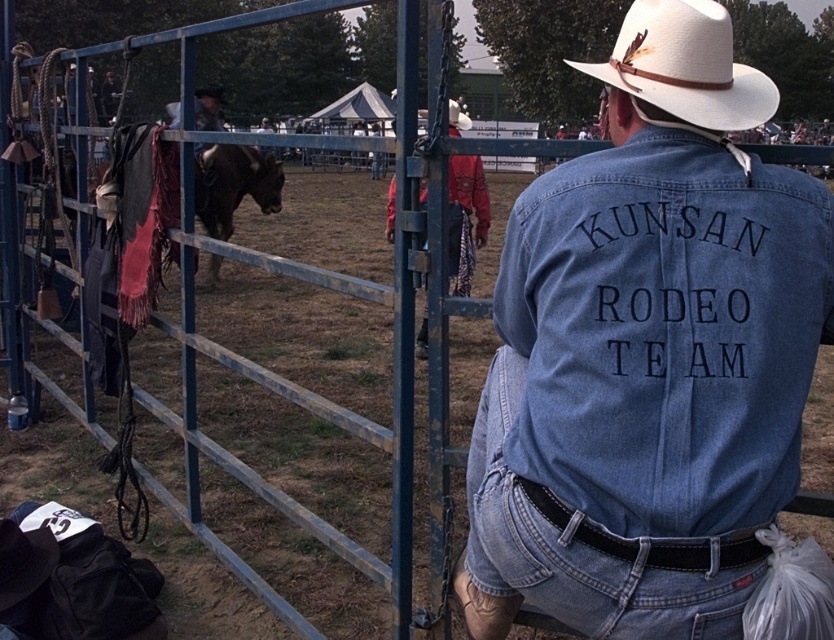
Question: Estimate the real-world distances between objects in this image. Which object is farther from the brown leather horse at center?

Choices:
 (A) denim at back
 (B) denim jacket at center

Answer: (B)

Question: Does denim jacket at center appear on the right side of denim at back?

Choices:
 (A) no
 (B) yes

Answer: (B)

Question: Considering the real-world distances, which object is farthest from the brown leather horse at center?

Choices:
 (A) denim at back
 (B) natural straw cowboy hat at upper center
 (C) denim jacket at center

Answer: (C)

Question: Does denim jacket at center have a greater width compared to denim at back?

Choices:
 (A) yes
 (B) no

Answer: (A)

Question: Which of the following is the farthest from the observer?

Choices:
 (A) tap(729, 540)
 (B) tap(267, 186)
 (C) tap(511, 308)

Answer: (B)

Question: Does denim jacket at center have a larger size compared to natural straw cowboy hat at upper center?

Choices:
 (A) yes
 (B) no

Answer: (B)